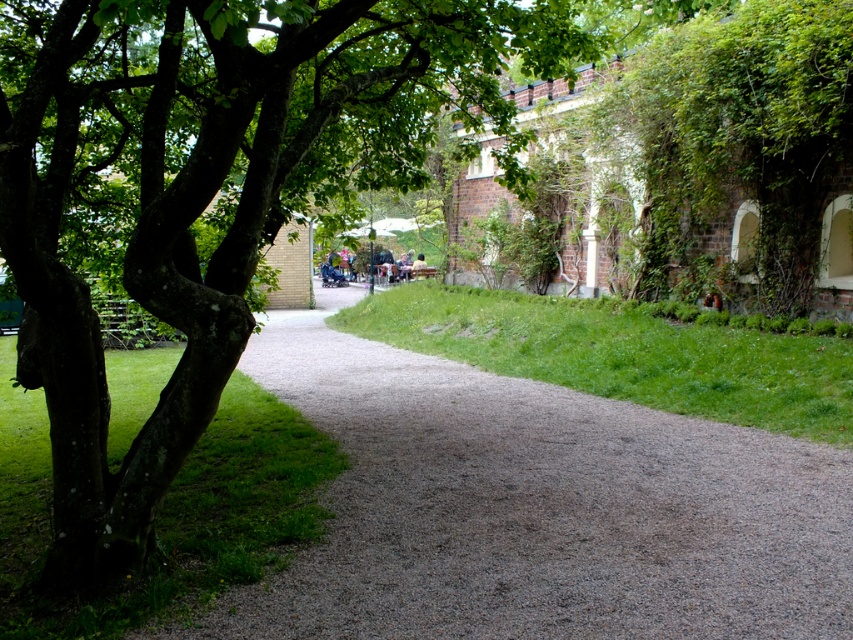
This screenshot has width=853, height=640. What do you see at coordinates (537, 508) in the screenshot?
I see `gray gravel path at center` at bounding box center [537, 508].

Is gray gravel path at center thinner than green grass at left?

Indeed, gray gravel path at center has a lesser width compared to green grass at left.

Is point (331, 424) in front of point (38, 592)?

No, (331, 424) is behind (38, 592).

This screenshot has width=853, height=640. In order to click on gray gravel path at center in this screenshot , I will do coord(537,508).

Is point (392, 476) in front of point (666, 410)?

Yes.

Is gray gravel path at center positioned at the back of green grass at center?

No, gray gravel path at center is closer to the viewer.

Between point (373, 502) and point (682, 406), which one is positioned in front?

Point (373, 502)

You are a GUI agent. You are given a task and a screenshot of the screen. Output one action in this format:
    pyautogui.click(x=<x>, y=<y>)
    Task: Click on the gray gravel path at center
    The image size is (853, 640).
    Given the screenshot: What is the action you would take?
    pyautogui.click(x=537, y=508)

Which is more to the right, green grass at left or green grass at center?

Positioned to the right is green grass at center.

Who is lower down, green grass at left or green grass at center?

Positioned lower is green grass at left.

Who is more forward, (172, 348) or (408, 348)?

Point (408, 348) is in front.

Find the location of a particular element. This screenshot has width=853, height=640. green grass at left is located at coordinates (163, 512).